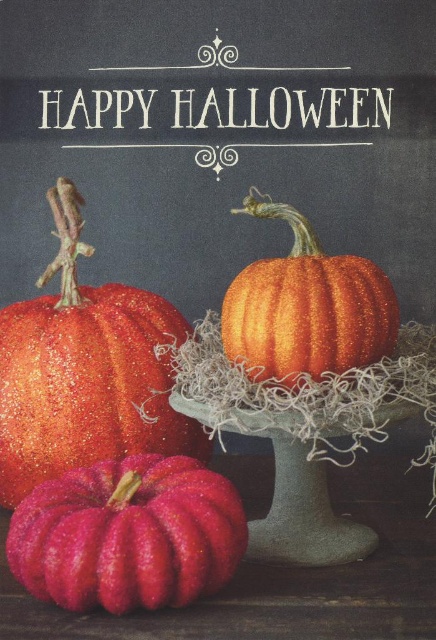
You are a child trying to find the pumpkin closest to the center of the image. You see the glittery orange pumpkin at lower left and the sparkly orange pumpkin at center. Which one is closer to the center?

The sparkly orange pumpkin at center is closer to the center of the image since it is positioned at the center, while the glittery orange pumpkin at lower left is on its left side.

You are a child trying to grab the shiny pink pumpkin at lower left and the sparkly orange pumpkin at center. Which one can you reach first without moving your position?

The shiny pink pumpkin at lower left is closer to the viewer than the sparkly orange pumpkin at center, so you can reach it first without moving your position.